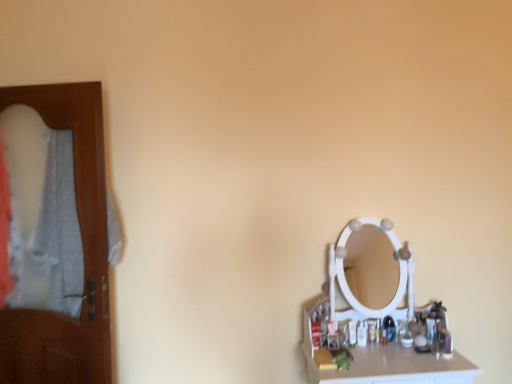
Question: Is white glossy counter top at lower right surrounding brown wooden door at left?

Choices:
 (A) yes
 (B) no

Answer: (B)

Question: Considering the relative sizes of white glossy counter top at lower right and brown wooden door at left in the image provided, is white glossy counter top at lower right smaller than brown wooden door at left?

Choices:
 (A) yes
 (B) no

Answer: (A)

Question: From the image's perspective, is white glossy counter top at lower right above brown wooden door at left?

Choices:
 (A) yes
 (B) no

Answer: (B)

Question: Does white glossy counter top at lower right have a greater height compared to brown wooden door at left?

Choices:
 (A) yes
 (B) no

Answer: (B)

Question: From a real-world perspective, is white glossy counter top at lower right over brown wooden door at left?

Choices:
 (A) yes
 (B) no

Answer: (B)

Question: Is white glossy counter top at lower right thinner than brown wooden door at left?

Choices:
 (A) no
 (B) yes

Answer: (A)

Question: Is translucent plastic bottle at right outside of white glossy counter top at lower right?

Choices:
 (A) yes
 (B) no

Answer: (A)

Question: Considering the relative positions of translucent plastic bottle at right and white glossy counter top at lower right in the image provided, is translucent plastic bottle at right behind white glossy counter top at lower right?

Choices:
 (A) yes
 (B) no

Answer: (A)

Question: Does translucent plastic bottle at right appear on the right side of white glossy counter top at lower right?

Choices:
 (A) no
 (B) yes

Answer: (A)

Question: From a real-world perspective, is translucent plastic bottle at right physically above white glossy counter top at lower right?

Choices:
 (A) yes
 (B) no

Answer: (A)

Question: Does translucent plastic bottle at right have a lesser width compared to white glossy counter top at lower right?

Choices:
 (A) yes
 (B) no

Answer: (A)

Question: Can you confirm if translucent plastic bottle at right is shorter than white glossy counter top at lower right?

Choices:
 (A) no
 (B) yes

Answer: (B)

Question: From the image's perspective, is brown wooden door at left under translucent plastic bottle at right?

Choices:
 (A) no
 (B) yes

Answer: (A)